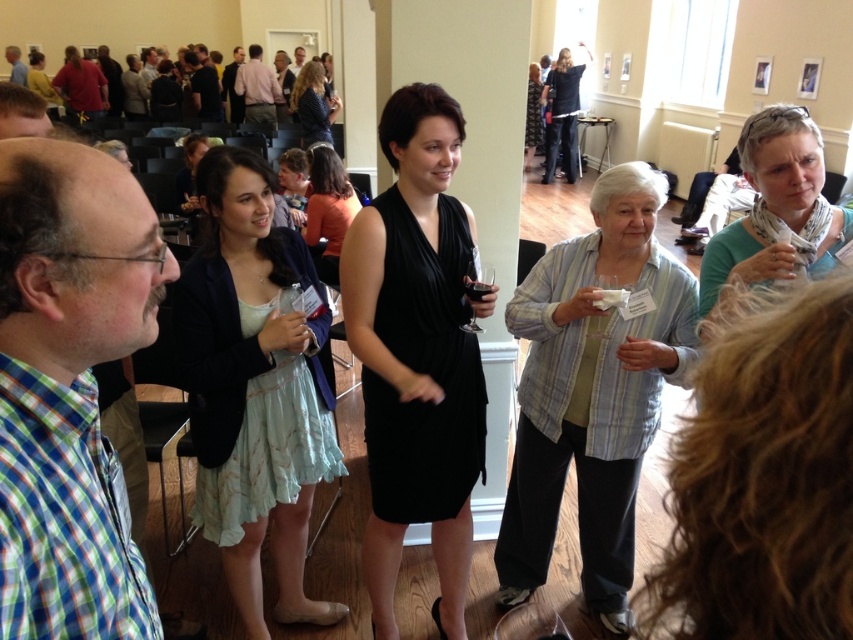
You are a photographer at the event and want to take a photo of the black dress at center without the white scarf at upper right blocking it. How should you adjust your position?

Move your camera position so that the white scarf at upper right is no longer in front of the black dress at center, perhaps by moving to the left or right to reposition yourself.